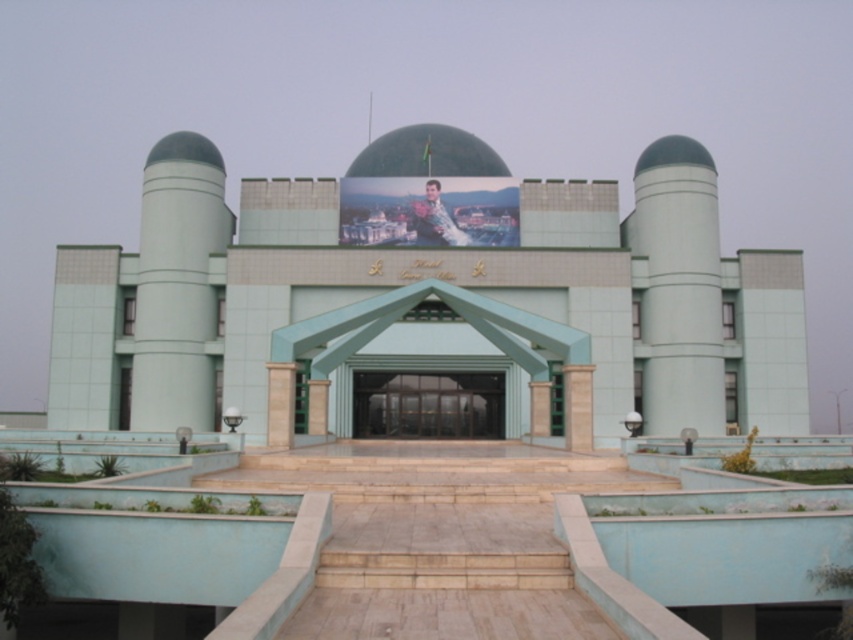
You are an architect planning to install a new decorative flagpole between the light green concrete pillar at left and the green concrete pillar at right. To ensure symmetry, you want the flagpole to be the same height as the shorter pillar. Which pillar should you use as a reference for the flagpole height?

The green concrete pillar at right is shorter than the light green concrete pillar at left, so you should use the green concrete pillar at right as a reference for the flagpole height to maintain symmetry.

You are standing outside the building and want to enter through the green glass doors at center. Which direction should you walk relative to the light green concrete pillar at left to reach the doors?

The light green concrete pillar at left is located above the green glass doors at center, so you should walk towards the base of the pillar to reach the doors.

You are an architect visiting this building and want to enter through the green glass doors at center. There is a light green concrete pillar at left blocking your path. Can you walk around it to reach the doors?

The light green concrete pillar at left is larger in size than green glass doors at center, so it may block your path. However, since pillars are typically solid structures, you would need to go around it to reach the green glass doors at center.